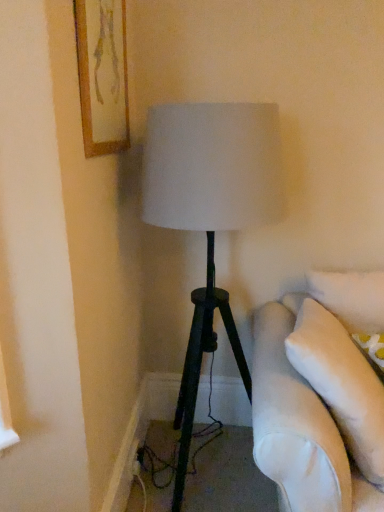
Question: Is point (107, 13) closer or farther from the camera than point (140, 458)?

Choices:
 (A) closer
 (B) farther

Answer: (A)

Question: Considering the relative positions of wooden framed artwork at upper left and black plastic outlet at lower left in the image provided, is wooden framed artwork at upper left to the left or to the right of black plastic outlet at lower left?

Choices:
 (A) right
 (B) left

Answer: (B)

Question: In terms of width, does wooden framed artwork at upper left look wider or thinner when compared to black plastic outlet at lower left?

Choices:
 (A) wide
 (B) thin

Answer: (A)

Question: Considering their positions, is black plastic outlet at lower left located in front of or behind wooden framed artwork at upper left?

Choices:
 (A) behind
 (B) front

Answer: (A)

Question: Does point (137, 448) appear closer or farther from the camera than point (114, 98)?

Choices:
 (A) farther
 (B) closer

Answer: (A)

Question: Would you say black plastic outlet at lower left is to the left or to the right of wooden framed artwork at upper left in the picture?

Choices:
 (A) left
 (B) right

Answer: (B)

Question: Choose the correct answer: Is black plastic outlet at lower left inside wooden framed artwork at upper left or outside it?

Choices:
 (A) outside
 (B) inside

Answer: (A)